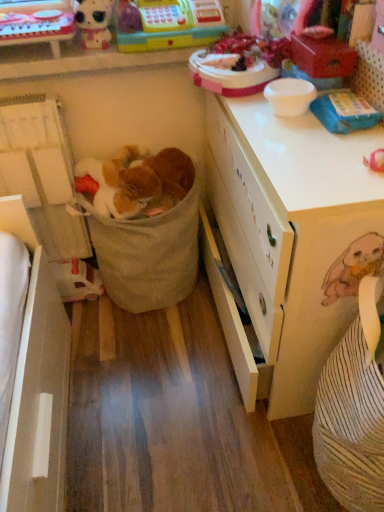
Question: Does white plastic toy at lower left, placed as the first toy when sorted from bottom to top, have a lesser height compared to white matte desk at center?

Choices:
 (A) yes
 (B) no

Answer: (A)

Question: Does white plastic toy at lower left, placed as the first toy when sorted from bottom to top, turn towards white matte desk at center?

Choices:
 (A) no
 (B) yes

Answer: (A)

Question: Is white matte desk at center completely or partially inside white plastic toy at lower left, the fourth toy from the top?

Choices:
 (A) no
 (B) yes

Answer: (A)

Question: Does white plastic toy at lower left, the fourth toy from the top, have a greater height compared to white matte desk at center?

Choices:
 (A) yes
 (B) no

Answer: (B)

Question: Is white plastic toy at lower left, placed as the first toy when sorted from bottom to top, located outside white matte desk at center?

Choices:
 (A) no
 (B) yes

Answer: (B)

Question: Does white plastic toy at lower left, the fourth toy from the top, have a larger size compared to white matte desk at center?

Choices:
 (A) no
 (B) yes

Answer: (A)

Question: From the image's perspective, would you say matte plastic doll at upper left, placed as the 1th toy when sorted from top to bottom, is positioned over white matte desk at center?

Choices:
 (A) no
 (B) yes

Answer: (B)

Question: Is matte plastic doll at upper left, placed as the 1th toy when sorted from top to bottom, shorter than white matte desk at center?

Choices:
 (A) yes
 (B) no

Answer: (A)

Question: Can you confirm if matte plastic doll at upper left, placed as the 1th toy when sorted from top to bottom, is taller than white matte desk at center?

Choices:
 (A) no
 (B) yes

Answer: (A)

Question: Considering the relative sizes of matte plastic doll at upper left, which ranks as the 4th toy in bottom-to-top order, and white matte desk at center in the image provided, is matte plastic doll at upper left, which ranks as the 4th toy in bottom-to-top order, bigger than white matte desk at center?

Choices:
 (A) yes
 (B) no

Answer: (B)

Question: Can you confirm if matte plastic doll at upper left, which ranks as the 4th toy in bottom-to-top order, is smaller than white matte desk at center?

Choices:
 (A) no
 (B) yes

Answer: (B)

Question: Is white matte desk at center completely or partially inside matte plastic doll at upper left, placed as the 1th toy when sorted from top to bottom?

Choices:
 (A) no
 (B) yes

Answer: (A)

Question: Does white matte desk at center have a smaller size compared to matte plastic toy at upper left?

Choices:
 (A) no
 (B) yes

Answer: (A)